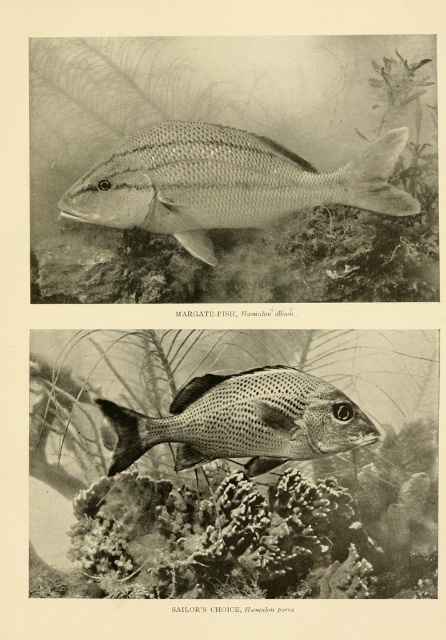
You are a marine biologist observing the underwater scene. You notice the speckled coral at center and the speckled silver fish at center. Which object occupies more space in the image?

The speckled coral at center is larger in size than the speckled silver fish at center, so it occupies more space in the image.

You are a marine biologist studying underwater environments. You observe the Margate fish in the top section of the image and notice a point labeled at coordinates (259,531). What object is located at that specific coordinate?

The object at point (259,531) is speckled coral at center.